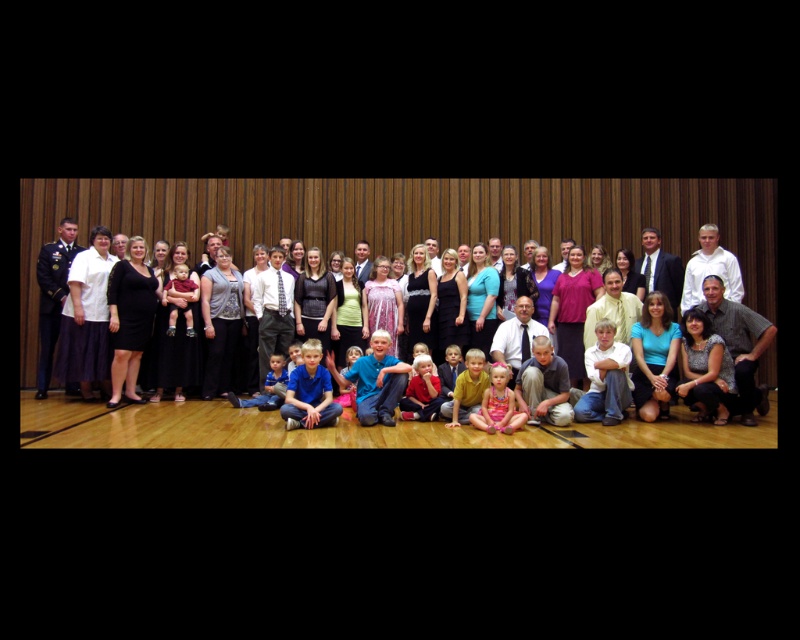
Looking at this image, you are a photographer trying to adjust the composition of the group photo. You notice the dark blue uniform at left and the matte black suit at center. Which of these two items is positioned lower in the frame?

The dark blue uniform at left is positioned below the matte black suit at center, so it is lower in the frame.

You are a photographer setting up for a group photo. You notice two central figures wearing a matte black dress at center and a white shirt at center. Which one is positioned lower in the frame?

The matte black dress at center is located below the white shirt at center, so it is positioned lower in the frame.

You are a photographer setting up for a group photo. You have two people in the front row wearing a matte black dress at center and a white shirt at center. Which one might require more space to accommodate their clothing?

The matte black dress at center might be wider than the white shirt at center, so it might require more space to accommodate the clothing.